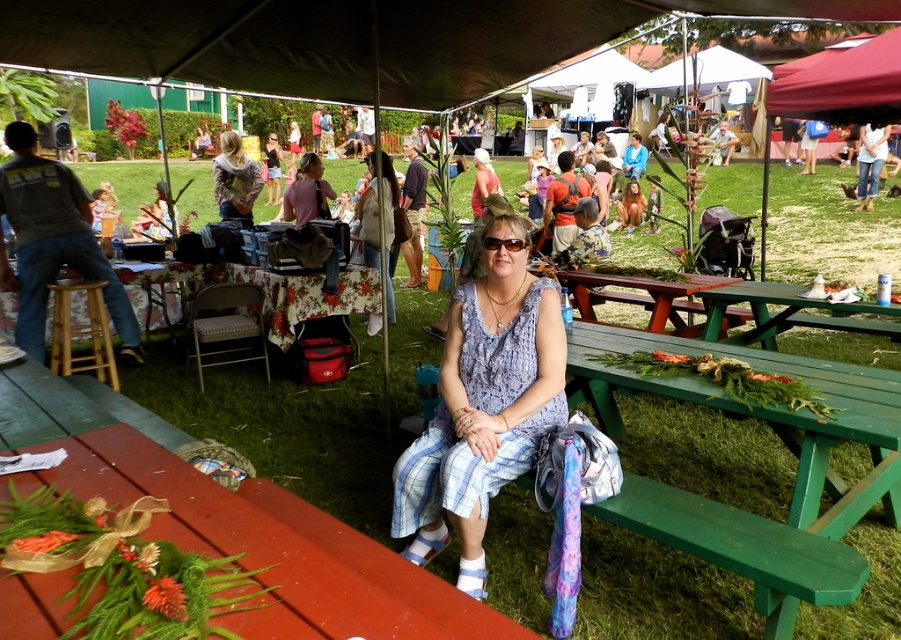
Can you confirm if green wooden picnic table at center is positioned above wooden stool at left?

Indeed, green wooden picnic table at center is positioned over wooden stool at left.

Locate an element on the screen. The width and height of the screenshot is (901, 640). green wooden picnic table at center is located at coordinates (787, 312).

In the scene shown: Can you confirm if matte blue dress at center is positioned above gray cotton shirt at left?

Incorrect, matte blue dress at center is not positioned above gray cotton shirt at left.

Can you confirm if matte blue dress at center is positioned to the left of gray cotton shirt at left?

In fact, matte blue dress at center is to the right of gray cotton shirt at left.

Between point (399, 492) and point (0, 264), which one is positioned in front?

Point (399, 492) is more forward.

Where is `matte blue dress at center`? matte blue dress at center is located at coordinates (483, 403).

Does wooden stool at left appear over denim jeans at center?

No, wooden stool at left is not above denim jeans at center.

How far apart are wooden stool at left and denim jeans at center?

A distance of 2.22 meters exists between wooden stool at left and denim jeans at center.

Where is `wooden stool at left`? wooden stool at left is located at coordinates (80, 332).